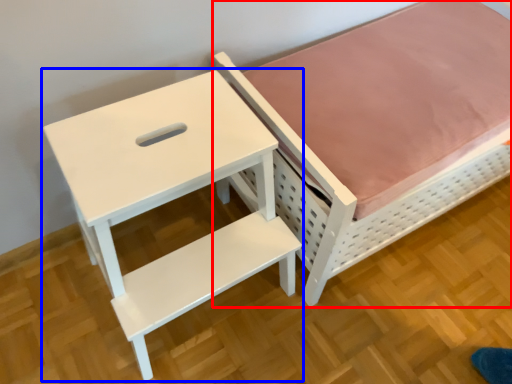
Question: Which point is further to the camera, furniture (highlighted by a red box) or table (highlighted by a blue box)?

Choices:
 (A) furniture
 (B) table

Answer: (A)